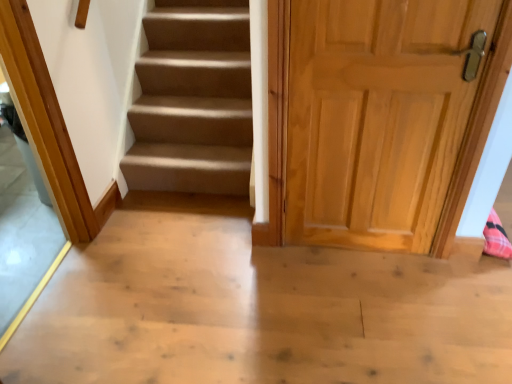
The image size is (512, 384). I want to click on vacant space in front of light brown wood door at right, so click(379, 311).